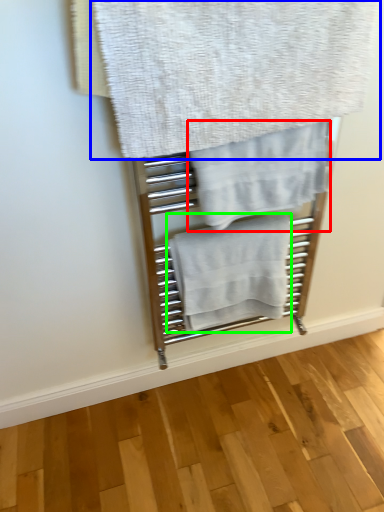
Question: Which object is the closest to the towel (highlighted by a red box)? Choose among these: towel (highlighted by a blue box) or towel (highlighted by a green box).

Choices:
 (A) towel
 (B) towel

Answer: (A)